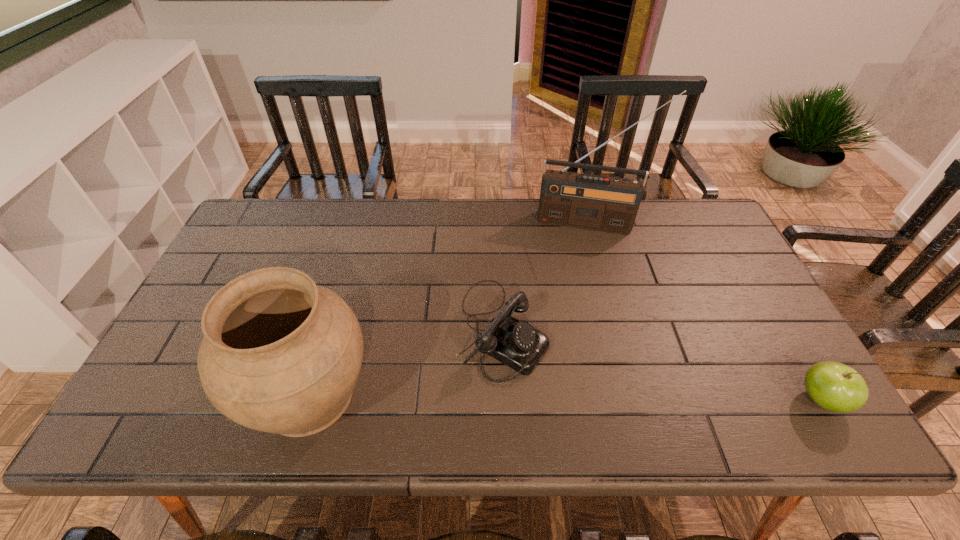
This screenshot has width=960, height=540. What are the coordinates of `urn` in the screenshot? It's located at (280, 354).

The width and height of the screenshot is (960, 540). I want to click on the leftmost object, so click(x=280, y=354).

Locate an element on the screen. the rightmost object is located at coordinates (834, 386).

Identify the location of the third object from right to left. (517, 344).

This screenshot has width=960, height=540. What are the coordinates of `the tallest object` in the screenshot? It's located at (607, 204).

Where is `the third object from left to right`? the third object from left to right is located at coordinates (607, 204).

Where is `vacant space located 0.190m on the right of the urn`? The image size is (960, 540). vacant space located 0.190m on the right of the urn is located at coordinates (458, 395).

Find the location of `free location located 0.130m on the back of the apple`. free location located 0.130m on the back of the apple is located at coordinates (781, 333).

Locate an element on the screen. The width and height of the screenshot is (960, 540). free spot located 0.080m on the front-facing side of the telephone is located at coordinates (572, 375).

Where is `free space located on the front-facing side of the telephone`? The height and width of the screenshot is (540, 960). free space located on the front-facing side of the telephone is located at coordinates (588, 383).